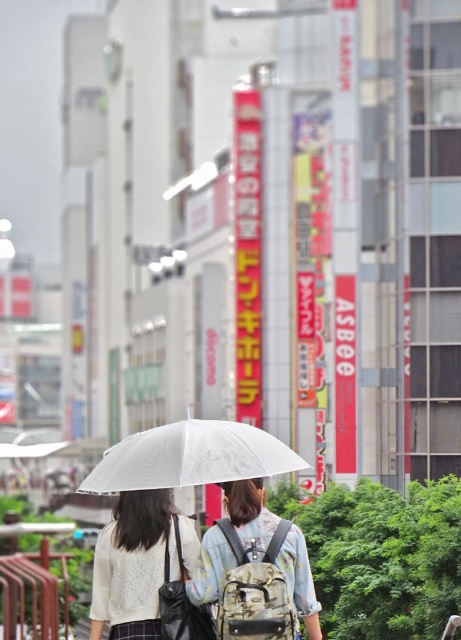
Does transparent plastic umbrella at center have a lesser height compared to transparent nylon umbrella at center?

In fact, transparent plastic umbrella at center may be taller than transparent nylon umbrella at center.

The image size is (461, 640). What do you see at coordinates (190, 456) in the screenshot? I see `transparent plastic umbrella at center` at bounding box center [190, 456].

Locate an element on the screen. This screenshot has width=461, height=640. transparent plastic umbrella at center is located at coordinates (190, 456).

Who is positioned more to the left, white matte umbrella at lower left or transparent nylon umbrella at center?

Positioned to the left is white matte umbrella at lower left.

Is white matte umbrella at lower left in front of transparent nylon umbrella at center?

No, white matte umbrella at lower left is behind transparent nylon umbrella at center.

Between point (137, 516) and point (243, 483), which one is positioned behind?

The point (137, 516) is behind.

Find the location of a particular element. white matte umbrella at lower left is located at coordinates (134, 564).

Does point (102, 484) come behind point (151, 504)?

That is True.

Where is `transparent plastic umbrella at center`? This screenshot has width=461, height=640. transparent plastic umbrella at center is located at coordinates (190, 456).